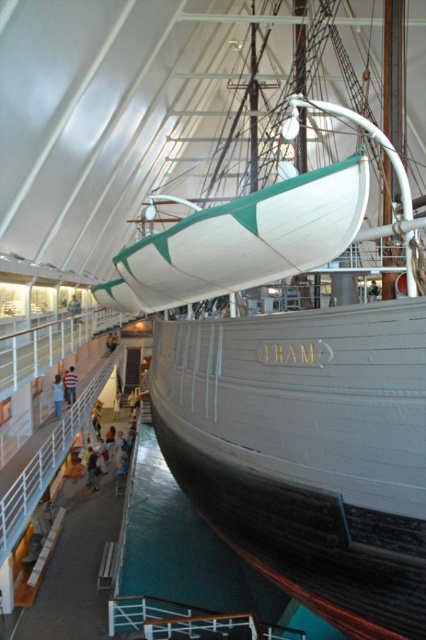
Which is above, white cotton shirt at center or light brown wooden person at center?

Positioned higher is light brown wooden person at center.

Can you confirm if white cotton shirt at center is positioned to the right of light brown wooden person at center?

Indeed, white cotton shirt at center is positioned on the right side of light brown wooden person at center.

Measure the distance between white cotton shirt at center and camera.

A distance of 64.74 feet exists between white cotton shirt at center and camera.

Identify the location of white cotton shirt at center. This screenshot has width=426, height=640. (69, 385).

Is white cotton shirt at center above white shirt at center?

Indeed, white cotton shirt at center is positioned over white shirt at center.

Is white cotton shirt at center positioned at the back of white shirt at center?

Yes, it is.

Locate an element on the screen. This screenshot has height=640, width=426. white cotton shirt at center is located at coordinates (69, 385).

The width and height of the screenshot is (426, 640). What do you see at coordinates (57, 396) in the screenshot?
I see `white shirt at center` at bounding box center [57, 396].

Between point (58, 394) and point (75, 312), which one is positioned behind?

Positioned behind is point (75, 312).

Locate an element on the screen. The width and height of the screenshot is (426, 640). white shirt at center is located at coordinates (57, 396).

Locate an element on the screen. This screenshot has height=640, width=426. white shirt at center is located at coordinates (57, 396).